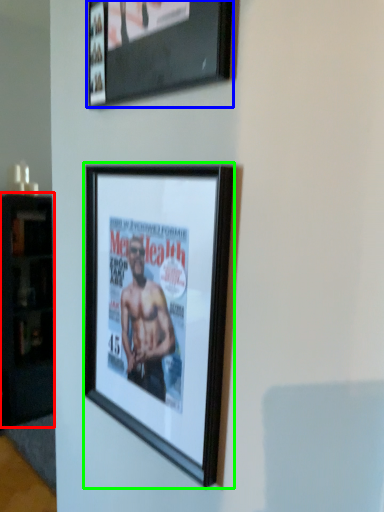
Question: Which is nearer to the cabinetry (highlighted by a red box)? picture frame (highlighted by a blue box) or picture frame (highlighted by a green box).

Choices:
 (A) picture frame
 (B) picture frame

Answer: (B)